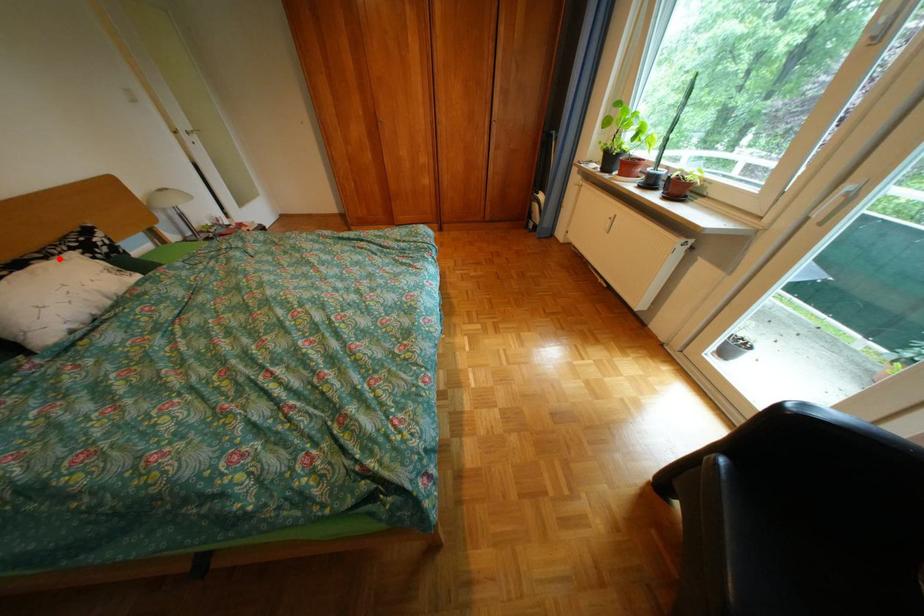
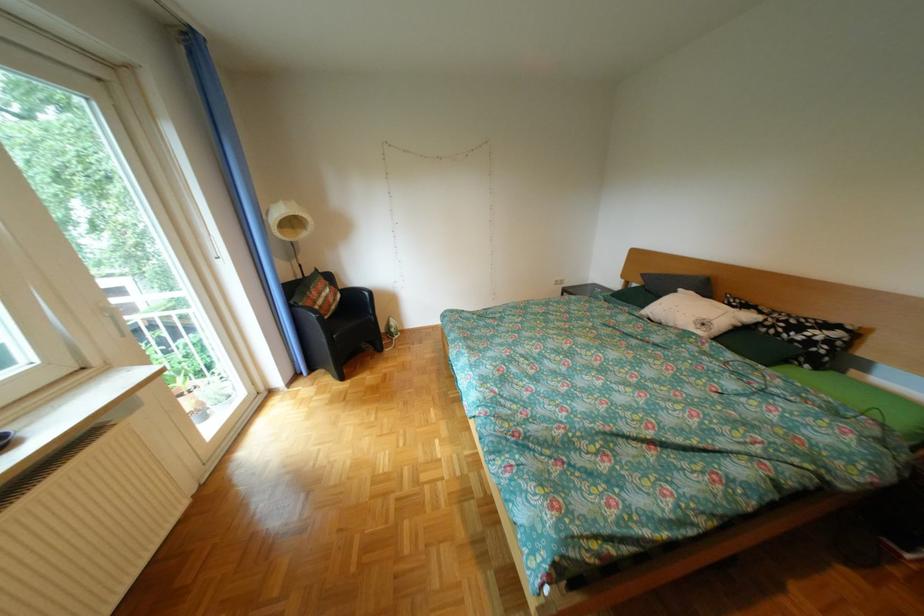
In the second image, find the point that corresponds to the highlighted location in the first image.

(775, 313)